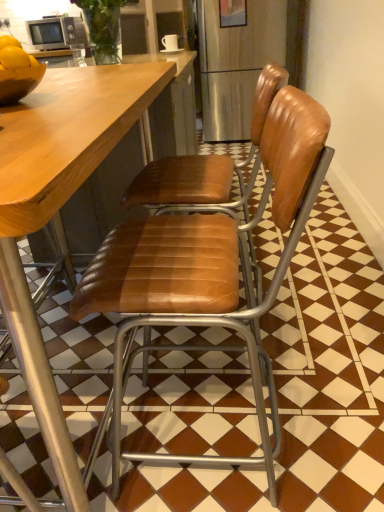
Question: Does shiny brown bowl at left have a lesser width compared to brown leather chair at center, acting as the second chair starting from the front?

Choices:
 (A) yes
 (B) no

Answer: (A)

Question: Is brown leather chair at center, the 1th chair from the back, inside shiny brown bowl at left?

Choices:
 (A) no
 (B) yes

Answer: (A)

Question: From a real-world perspective, is shiny brown bowl at left under brown leather chair at center, the 1th chair from the back?

Choices:
 (A) no
 (B) yes

Answer: (A)

Question: Is shiny brown bowl at left positioned beyond the bounds of brown leather chair at center, the 1th chair from the back?

Choices:
 (A) yes
 (B) no

Answer: (A)

Question: Is shiny brown bowl at left looking in the opposite direction of brown leather chair at center, the 1th chair from the back?

Choices:
 (A) no
 (B) yes

Answer: (A)

Question: Is matte silver microwave at upper left bigger or smaller than brown leather chair at center, the 1th chair from the back?

Choices:
 (A) small
 (B) big

Answer: (A)

Question: Based on their positions, is matte silver microwave at upper left located to the left or right of brown leather chair at center, acting as the second chair starting from the front?

Choices:
 (A) right
 (B) left

Answer: (B)

Question: Considering their positions, is matte silver microwave at upper left located in front of or behind brown leather chair at center, acting as the second chair starting from the front?

Choices:
 (A) front
 (B) behind

Answer: (B)

Question: In terms of height, does matte silver microwave at upper left look taller or shorter compared to brown leather chair at center, acting as the second chair starting from the front?

Choices:
 (A) short
 (B) tall

Answer: (A)

Question: From the image's perspective, is shiny brown bowl at left positioned above or below brown leather chair at center, acting as the second chair starting from the front?

Choices:
 (A) above
 (B) below

Answer: (A)

Question: In the image, is shiny brown bowl at left on the left side or the right side of brown leather chair at center, the 1th chair from the back?

Choices:
 (A) left
 (B) right

Answer: (A)

Question: In the image, is shiny brown bowl at left positioned in front of or behind brown leather chair at center, acting as the second chair starting from the front?

Choices:
 (A) behind
 (B) front

Answer: (B)

Question: Is shiny brown bowl at left inside or outside of brown leather chair at center, acting as the second chair starting from the front?

Choices:
 (A) outside
 (B) inside

Answer: (A)

Question: Looking at their shapes, would you say brown leather chair at center, which appears as the second chair when viewed from the back, is wider or thinner than brown leather chair at center, the 1th chair from the back?

Choices:
 (A) wide
 (B) thin

Answer: (A)

Question: In the image, is brown leather chair at center, which appears as the second chair when viewed from the back, on the left side or the right side of brown leather chair at center, the 1th chair from the back?

Choices:
 (A) right
 (B) left

Answer: (B)